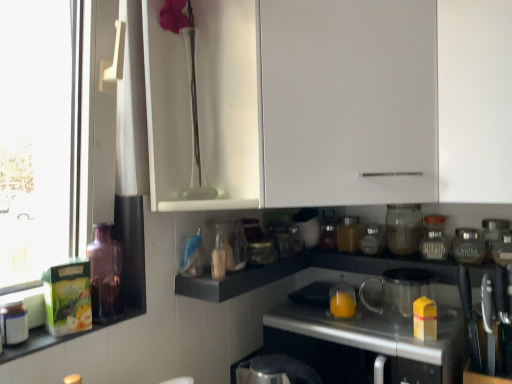
Question: Is translucent glass bottle at left, which is the 5th bottle from back to front, thinner than white glossy jar at center, which is the 2th appliance from left to right?

Choices:
 (A) yes
 (B) no

Answer: (A)

Question: Is translucent glass bottle at left, placed as the 5th bottle when sorted from right to left, further to the viewer compared to white glossy jar at center, which is the 2th appliance from left to right?

Choices:
 (A) no
 (B) yes

Answer: (A)

Question: From the image's perspective, is translucent glass bottle at left, which is the second bottle in left-to-right order, on white glossy jar at center, the 5th appliance viewed from the right?

Choices:
 (A) no
 (B) yes

Answer: (A)

Question: From a real-world perspective, does translucent glass bottle at left, placed as the 5th bottle when sorted from right to left, sit lower than white glossy jar at center, the 5th appliance viewed from the right?

Choices:
 (A) no
 (B) yes

Answer: (B)

Question: Is translucent glass bottle at left, placed as the 5th bottle when sorted from right to left, facing away from white glossy jar at center, which is the 2th appliance from left to right?

Choices:
 (A) no
 (B) yes

Answer: (A)

Question: Relative to black matte shelf at center, is translucent glass jar at center, marked as the third bottle in a left-to-right arrangement, in front or behind?

Choices:
 (A) behind
 (B) front

Answer: (A)

Question: In terms of size, does translucent glass jar at center, positioned as the 6th bottle in front-to-back order, appear bigger or smaller than black matte shelf at center?

Choices:
 (A) big
 (B) small

Answer: (B)

Question: Based on their positions, is translucent glass jar at center, marked as the third bottle in a left-to-right arrangement, located to the left or right of black matte shelf at center?

Choices:
 (A) left
 (B) right

Answer: (B)

Question: From a real-world perspective, is translucent glass jar at center, acting as the first bottle starting from the back, above or below black matte shelf at center?

Choices:
 (A) above
 (B) below

Answer: (A)

Question: From their relative heights in the image, would you say metallic silver countertop at center is taller or shorter than clear glass jar at right, the 1th bottle when ordered from right to left?

Choices:
 (A) tall
 (B) short

Answer: (A)

Question: Is metallic silver countertop at center inside the boundaries of clear glass jar at right, the fourth bottle positioned from the back, or outside?

Choices:
 (A) inside
 (B) outside

Answer: (B)

Question: Is point (298, 317) positioned closer to the camera than point (433, 253)?

Choices:
 (A) closer
 (B) farther

Answer: (B)

Question: In terms of width, does metallic silver countertop at center look wider or thinner when compared to clear glass jar at right, the fourth bottle positioned from the back?

Choices:
 (A) wide
 (B) thin

Answer: (A)

Question: Considering the positions of translucent glass jar at center, which is the 3th bottle in right-to-left order, and transparent glass jar at lower center, the fourth appliance viewed from the left, in the image, is translucent glass jar at center, which is the 3th bottle in right-to-left order, wider or thinner than transparent glass jar at lower center, the fourth appliance viewed from the left,?

Choices:
 (A) wide
 (B) thin

Answer: (B)

Question: In terms of height, does translucent glass jar at center, acting as the second bottle starting from the back, look taller or shorter compared to transparent glass jar at lower center, the third appliance when ordered from right to left?

Choices:
 (A) tall
 (B) short

Answer: (B)